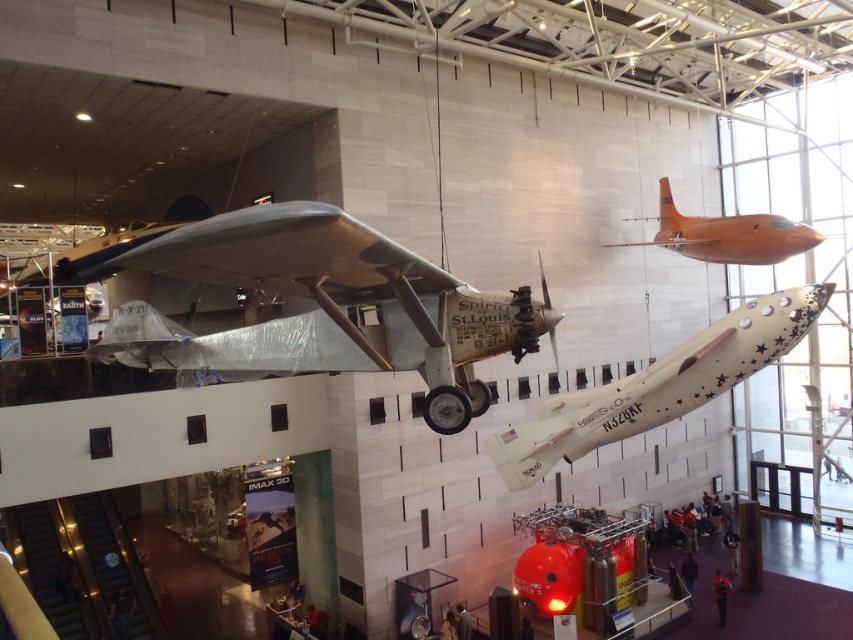
Question: Can you confirm if silver metallic airplane at center is positioned to the right of white matte airplane at center?

Choices:
 (A) yes
 (B) no

Answer: (B)

Question: Which object is farther from the camera taking this photo?

Choices:
 (A) orange glossy airplane at upper right
 (B) silver metallic airplane at center
 (C) white matte airplane at center

Answer: (A)

Question: Is silver metallic airplane at center positioned at the back of white matte airplane at center?

Choices:
 (A) yes
 (B) no

Answer: (B)

Question: Is silver metallic airplane at center smaller than orange glossy airplane at upper right?

Choices:
 (A) yes
 (B) no

Answer: (B)

Question: Estimate the real-world distances between objects in this image. Which object is closer to the orange glossy airplane at upper right?

Choices:
 (A) white matte airplane at center
 (B) silver metallic airplane at center

Answer: (B)

Question: Which object is the closest to the white matte airplane at center?

Choices:
 (A) orange glossy airplane at upper right
 (B) silver metallic airplane at center

Answer: (B)